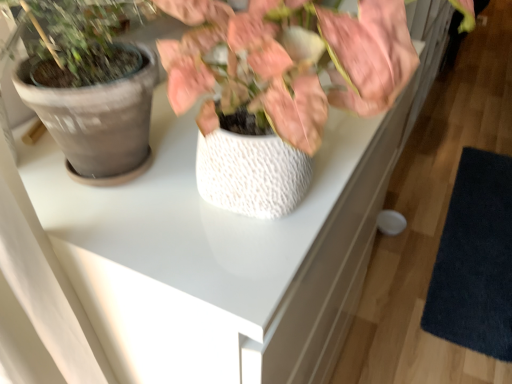
Question: From a real-world perspective, is dark blue textured mat at lower right on white textured pot at center?

Choices:
 (A) no
 (B) yes

Answer: (A)

Question: Is dark blue textured mat at lower right directly adjacent to white textured pot at center?

Choices:
 (A) yes
 (B) no

Answer: (B)

Question: Does dark blue textured mat at lower right come in front of white textured pot at center?

Choices:
 (A) no
 (B) yes

Answer: (A)

Question: Does dark blue textured mat at lower right lie behind white textured pot at center?

Choices:
 (A) yes
 (B) no

Answer: (A)

Question: Could you tell me if dark blue textured mat at lower right is turned towards white textured pot at center?

Choices:
 (A) no
 (B) yes

Answer: (A)

Question: Is dark blue textured mat at lower right completely or partially outside of white textured pot at center?

Choices:
 (A) yes
 (B) no

Answer: (A)

Question: Is white textured pot at center located outside dark blue textured mat at lower right?

Choices:
 (A) yes
 (B) no

Answer: (A)

Question: Are white textured pot at center and dark blue textured mat at lower right far apart?

Choices:
 (A) no
 (B) yes

Answer: (B)

Question: Is dark blue textured mat at lower right a part of white textured pot at center?

Choices:
 (A) no
 (B) yes

Answer: (A)

Question: Is white textured pot at center further to camera compared to dark blue textured mat at lower right?

Choices:
 (A) yes
 (B) no

Answer: (B)

Question: Can you confirm if white textured pot at center is thinner than dark blue textured mat at lower right?

Choices:
 (A) no
 (B) yes

Answer: (B)

Question: Is white textured pot at center oriented towards dark blue textured mat at lower right?

Choices:
 (A) no
 (B) yes

Answer: (A)

Question: Based on their positions, is white textured pot at center located to the left or right of dark blue textured mat at lower right?

Choices:
 (A) left
 (B) right

Answer: (A)